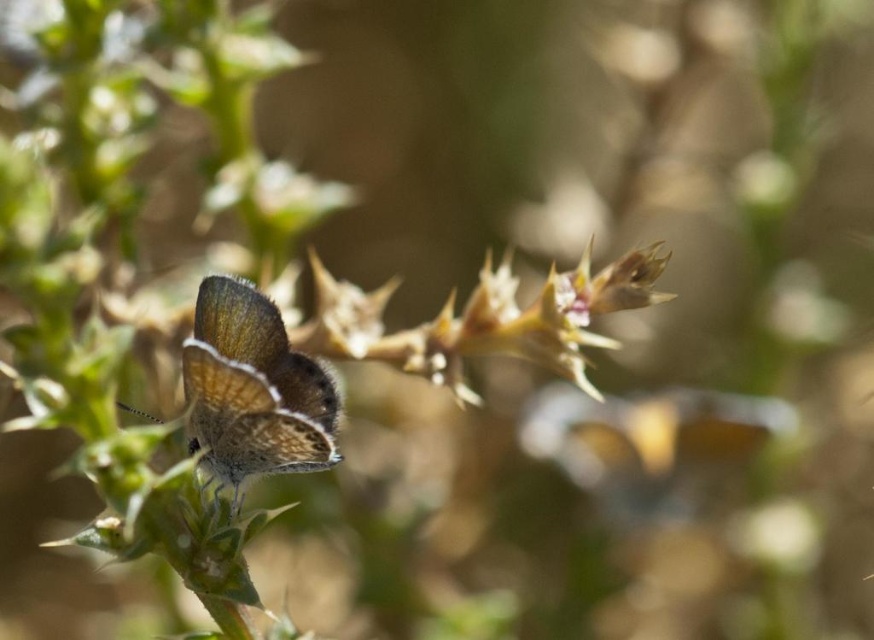
Is brown spiny thorn at center positioned behind satin brown butterfly at center?

Yes, brown spiny thorn at center is behind satin brown butterfly at center.

From the picture: Is brown spiny thorn at center below satin brown butterfly at center?

No, brown spiny thorn at center is not below satin brown butterfly at center.

Find the location of `brown spiny thorn at center`. brown spiny thorn at center is located at coordinates (484, 320).